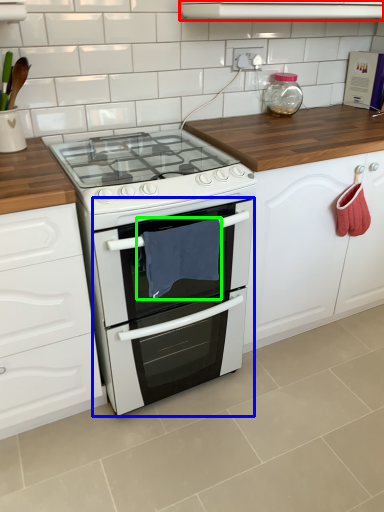
Question: Which is farther away from vent (highlighted by a red box)? oven (highlighted by a blue box) or material (highlighted by a green box)?

Choices:
 (A) oven
 (B) material

Answer: (A)